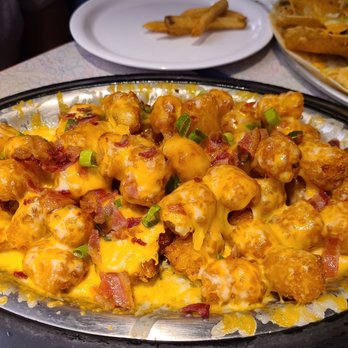
Find the location of a particular element. The image size is (348, 348). white countertop is located at coordinates (82, 66).